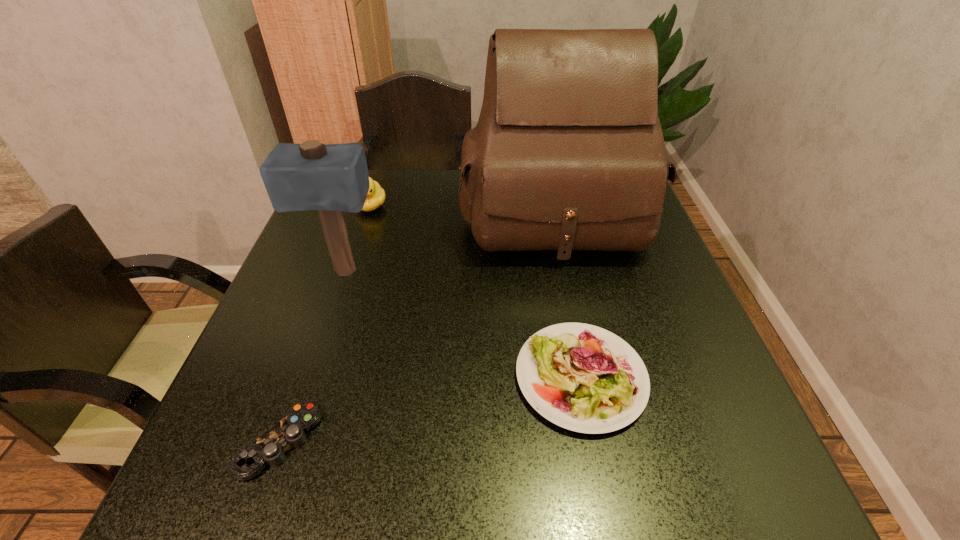
Find the location of a particular element. This screenshot has width=960, height=540. free point between the second shortest object and the tallest object is located at coordinates (566, 295).

The image size is (960, 540). Identify the location of free space between the duckling and the shortest object. (325, 323).

You are a GUI agent. You are given a task and a screenshot of the screen. Output one action in this format:
    pyautogui.click(x=<x>, y=<y>)
    Task: Click on the third closest object to the tallest object
    The image size is (960, 540).
    Given the screenshot: What is the action you would take?
    pyautogui.click(x=375, y=198)

Locate an element on the screen. The width and height of the screenshot is (960, 540). object that stands as the fourth closest to the fourth tallest object is located at coordinates (375, 198).